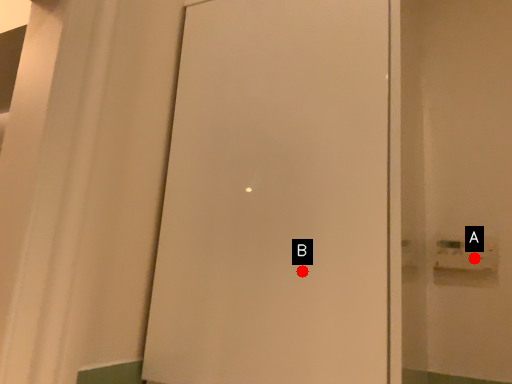
Question: Two points are circled on the image, labeled by A and B beside each circle. Which point appears closest to the camera in this image?

Choices:
 (A) A is closer
 (B) B is closer

Answer: (B)